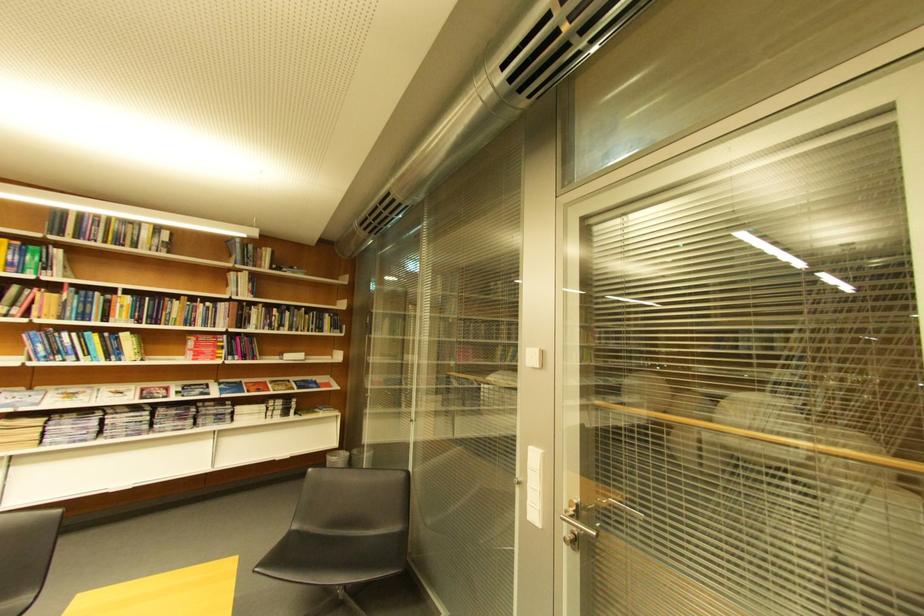
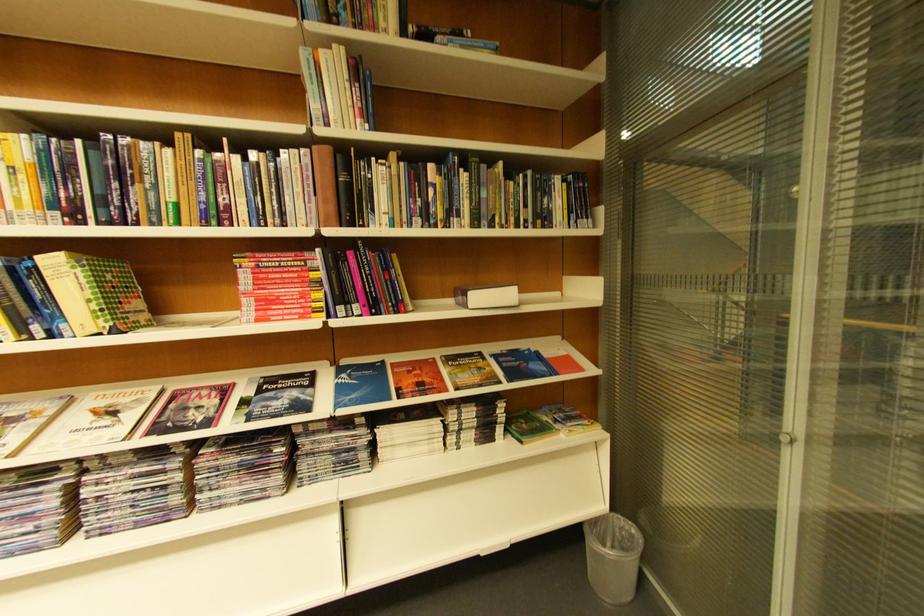
Find the pixel in the second image that matches point 331,331 in the first image.

(554, 221)